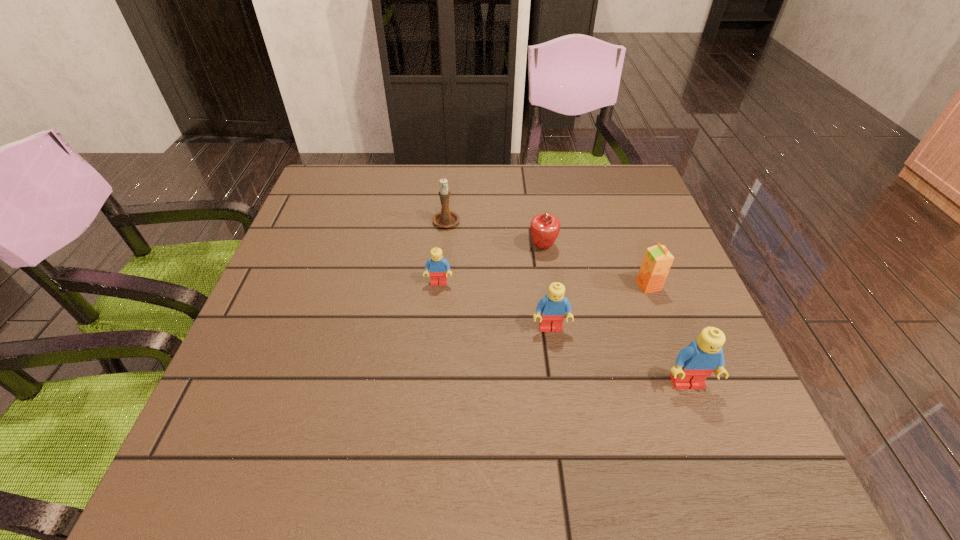
Please point a free position for a Lego on the left. Please provide its 2D coordinates. Your answer should be formatted as a tuple, i.e. [(x, y)], where the tuple contains the x and y coordinates of a point satisfying the conditions above.

[(347, 245)]